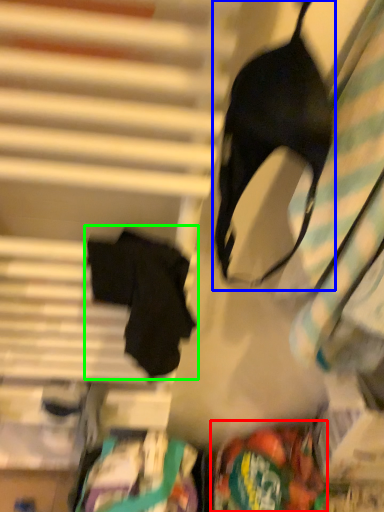
Question: Estimate the real-world distances between objects in this image. Which object is closer to waste (highlighted by a red box), brassiere (highlighted by a blue box) or robe (highlighted by a green box)?

Choices:
 (A) brassiere
 (B) robe

Answer: (B)